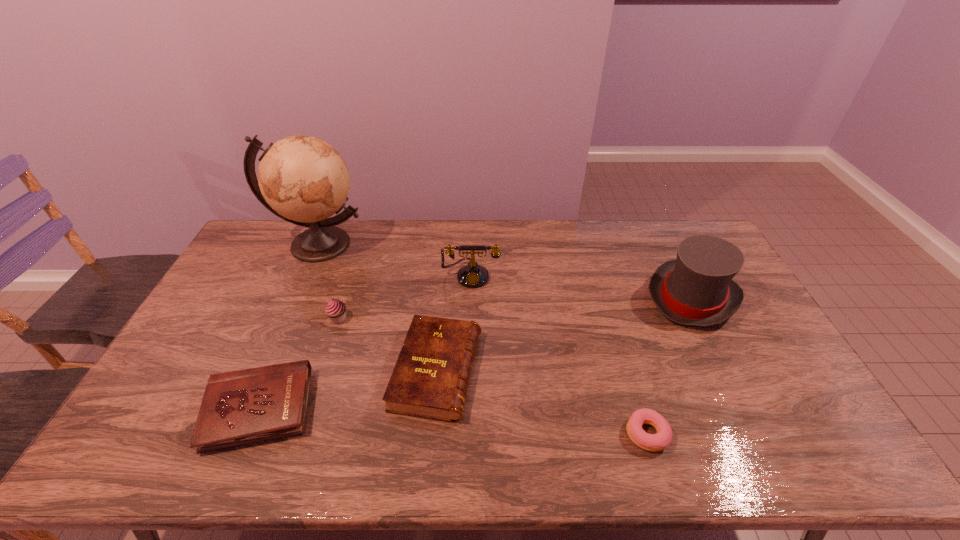
The image size is (960, 540). What are the coordinates of `object located in the right edge section of the desktop` in the screenshot? It's located at (696, 289).

Where is `object that is at the far left corner`? Image resolution: width=960 pixels, height=540 pixels. object that is at the far left corner is located at coordinates (303, 180).

You are a GUI agent. You are given a task and a screenshot of the screen. Output one action in this format:
    pyautogui.click(x=<x>, y=<y>)
    Task: Click on the vacant area at the far edge of the desktop
    This screenshot has width=960, height=540.
    Given the screenshot: What is the action you would take?
    pyautogui.click(x=405, y=233)

The height and width of the screenshot is (540, 960). I want to click on vacant space at the near edge of the desktop, so click(x=677, y=462).

Where is `vacant space at the right edge of the desktop`? The image size is (960, 540). vacant space at the right edge of the desktop is located at coordinates (756, 377).

At what (x,y) coordinates should I click in order to perform the action: click on vacant region at the far left corner of the desktop. Please return your answer as a coordinate pair (x, y). Image resolution: width=960 pixels, height=540 pixels. Looking at the image, I should click on (276, 220).

At what (x,y) coordinates should I click in order to perform the action: click on free space between the telephone and the left hardback book. Please return your answer as a coordinate pair (x, y). The image size is (960, 540). Looking at the image, I should click on (365, 342).

The height and width of the screenshot is (540, 960). Identify the location of empty space that is in between the fourth shortest object and the tallest object. (328, 281).

Identify the location of empty space that is in between the dress hat and the shortest object. (670, 365).

The height and width of the screenshot is (540, 960). I want to click on empty space between the right hardback book and the second object from right to left, so click(x=542, y=402).